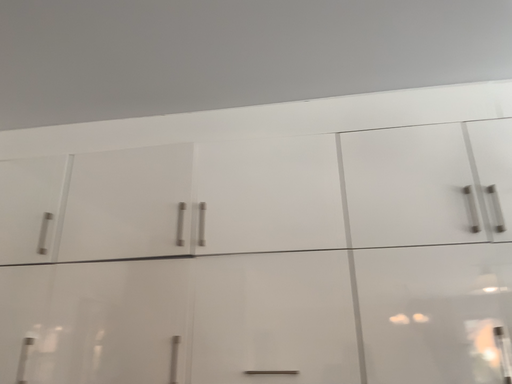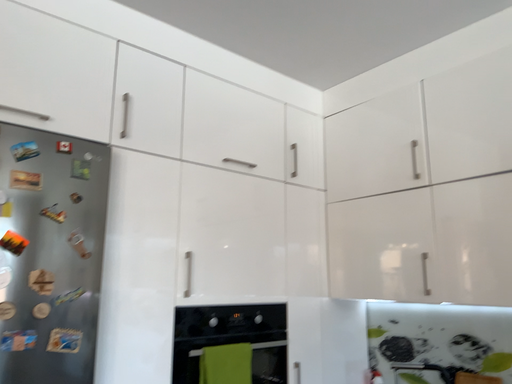
Question: How did the camera likely rotate when shooting the video?

Choices:
 (A) rotated downward
 (B) rotated upward

Answer: (A)